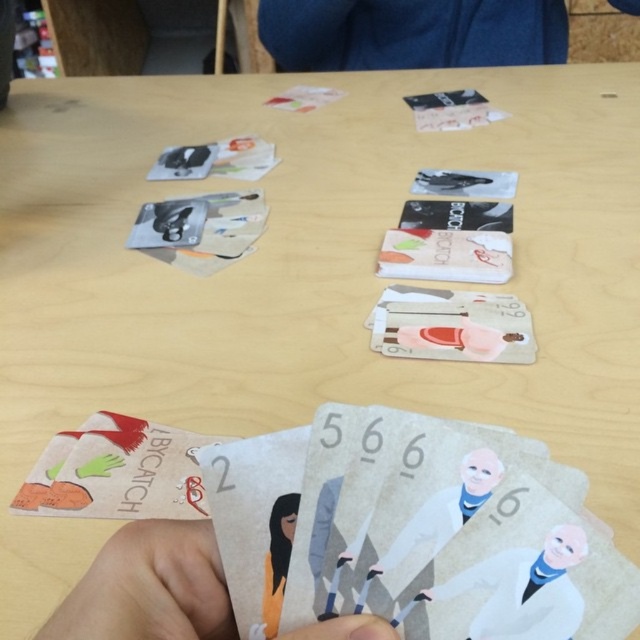
Between point (173, 509) and point (490, 588), which one is positioned in front?

Point (490, 588) is more forward.

Which is behind, point (88, 452) or point (566, 634)?

Positioned behind is point (88, 452).

This screenshot has height=640, width=640. Describe the element at coordinates (116, 472) in the screenshot. I see `matte cardboard card at lower left` at that location.

Locate an element on the screen. matte cardboard card at lower left is located at coordinates (116, 472).

Between matte paper card at lower center and matte cardboard card at lower left, which one appears on the right side from the viewer's perspective?

Positioned to the right is matte paper card at lower center.

Which is more to the left, matte paper card at lower center or matte cardboard card at lower left?

matte cardboard card at lower left

Between point (308, 632) and point (97, 445), which one is positioned in front?

Point (308, 632) is more forward.

Where is `matte paper card at lower center`? This screenshot has height=640, width=640. matte paper card at lower center is located at coordinates (148, 588).

Does matte paper card at lower center have a smaller size compared to white paper character at center?

No.

Is matte paper card at lower center positioned at the back of white paper character at center?

No, matte paper card at lower center is in front of white paper character at center.

The height and width of the screenshot is (640, 640). What are the coordinates of `matte paper card at lower center` in the screenshot? It's located at (148, 588).

This screenshot has width=640, height=640. In order to click on matte paper card at lower center in this screenshot , I will do `click(148, 588)`.